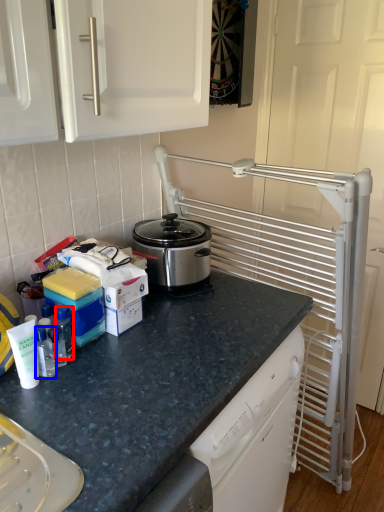
Question: Which object appears farthest to the camera in this image, bottle (highlighted by a red box) or bottle (highlighted by a blue box)?

Choices:
 (A) bottle
 (B) bottle

Answer: (A)